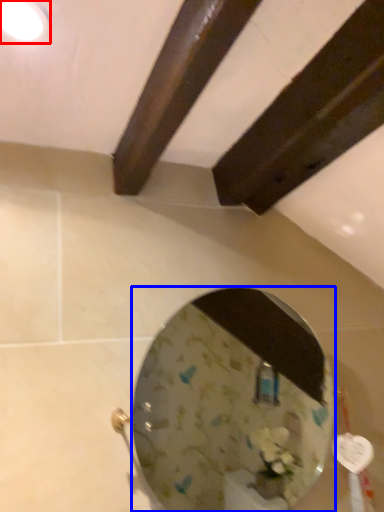
Question: Among these objects, which one is nearest to the camera, light fixture (highlighted by a red box) or mirror (highlighted by a blue box)?

Choices:
 (A) light fixture
 (B) mirror

Answer: (A)